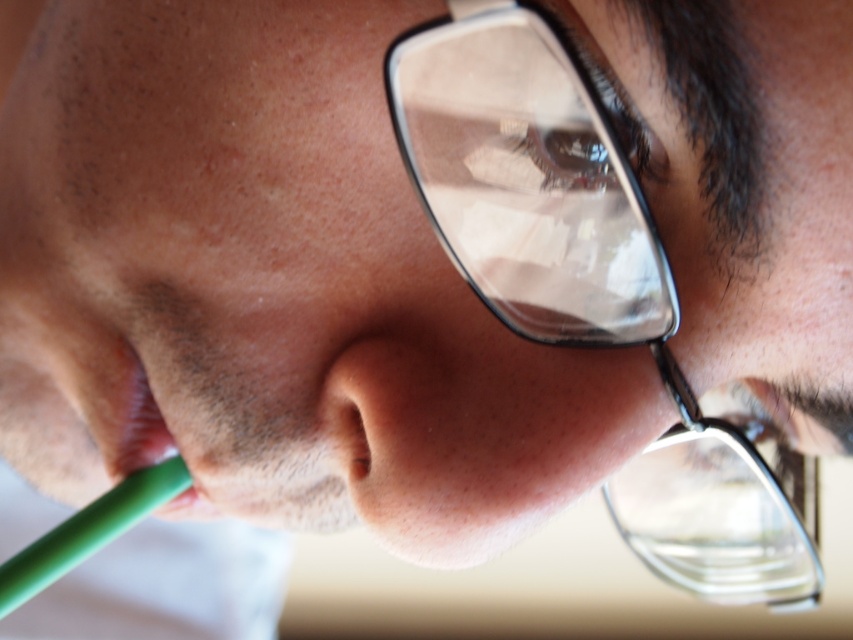
Question: Which point is closer to the camera?

Choices:
 (A) green rubber straw at lower left
 (B) green plastic straw at lower left

Answer: (A)

Question: Can you confirm if green plastic straw at lower left is smaller than green rubber straw at lower left?

Choices:
 (A) no
 (B) yes

Answer: (A)

Question: Which object appears farthest from the camera in this image?

Choices:
 (A) green rubber straw at lower left
 (B) green plastic straw at lower left

Answer: (B)

Question: Does green plastic straw at lower left appear over green rubber straw at lower left?

Choices:
 (A) yes
 (B) no

Answer: (B)

Question: Observing the image, what is the correct spatial positioning of green plastic straw at lower left in reference to green rubber straw at lower left?

Choices:
 (A) above
 (B) below

Answer: (B)